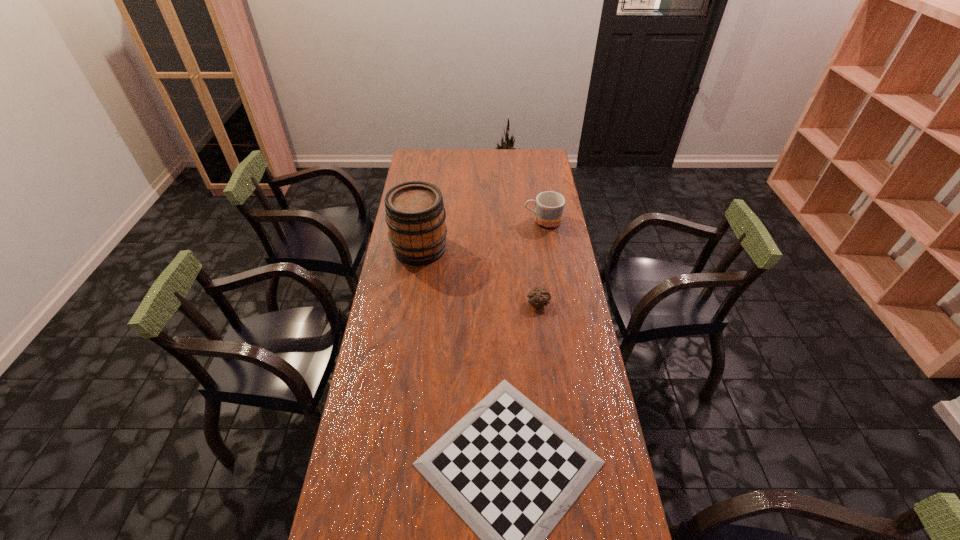
You are a GUI agent. You are given a task and a screenshot of the screen. Output one action in this format:
    pyautogui.click(x=<x>, y=<y>)
    Task: Click on the tallest object
    This screenshot has height=540, width=960.
    Given the screenshot: What is the action you would take?
    pyautogui.click(x=415, y=214)

Identify the location of cider. The image size is (960, 540). (415, 214).

I want to click on mug, so click(x=549, y=205).

At what (x,y) coordinates should I click in order to perform the action: click on the third shortest object. Please return your answer as a coordinate pair (x, y). The image size is (960, 540). Looking at the image, I should click on (549, 205).

Where is `muffin`? The height and width of the screenshot is (540, 960). muffin is located at coordinates click(538, 297).

Identify the location of the third tallest object. (538, 297).

Where is `free space located on the back of the second farthest object`? free space located on the back of the second farthest object is located at coordinates (425, 212).

Where is `vacant region located 0.240m on the side with the handle of the second tallest object`? vacant region located 0.240m on the side with the handle of the second tallest object is located at coordinates click(x=471, y=221).

Find the location of a particular element. free space located on the side with the handle of the second tallest object is located at coordinates (458, 221).

Find the location of `vacant point located 0.050m on the side with the handle of the second tallest object`. vacant point located 0.050m on the side with the handle of the second tallest object is located at coordinates (513, 221).